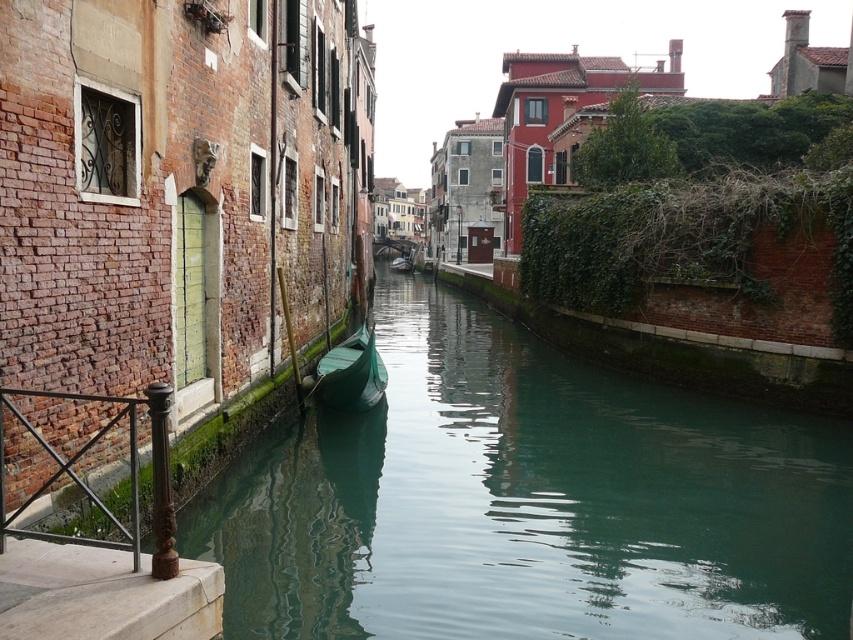
Question: Which object appears farthest from the camera in this image?

Choices:
 (A) green matte boat at center
 (B) brown wrought iron railing at lower left

Answer: (A)

Question: Does brown wrought iron railing at lower left appear on the right side of green matte boat at center?

Choices:
 (A) yes
 (B) no

Answer: (B)

Question: Which object is farther from the camera taking this photo?

Choices:
 (A) green matte boat at center
 (B) brown wrought iron railing at lower left

Answer: (A)

Question: Does brown wrought iron railing at lower left come in front of green matte boat at center?

Choices:
 (A) yes
 (B) no

Answer: (A)

Question: Can you confirm if brown wrought iron railing at lower left is positioned above green matte boat at center?

Choices:
 (A) yes
 (B) no

Answer: (B)

Question: Which object is farther from the camera taking this photo?

Choices:
 (A) green matte boat at center
 (B) brown wrought iron railing at lower left

Answer: (A)